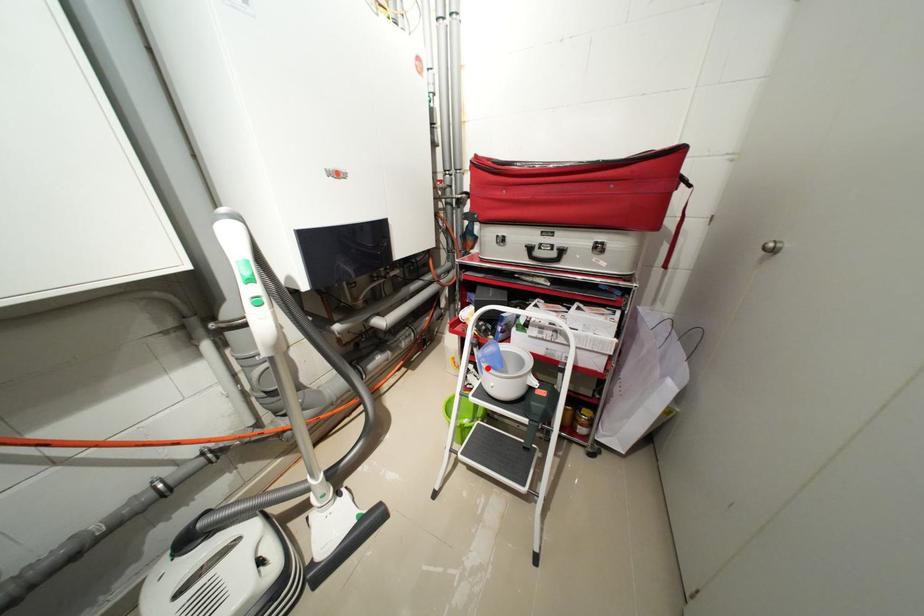
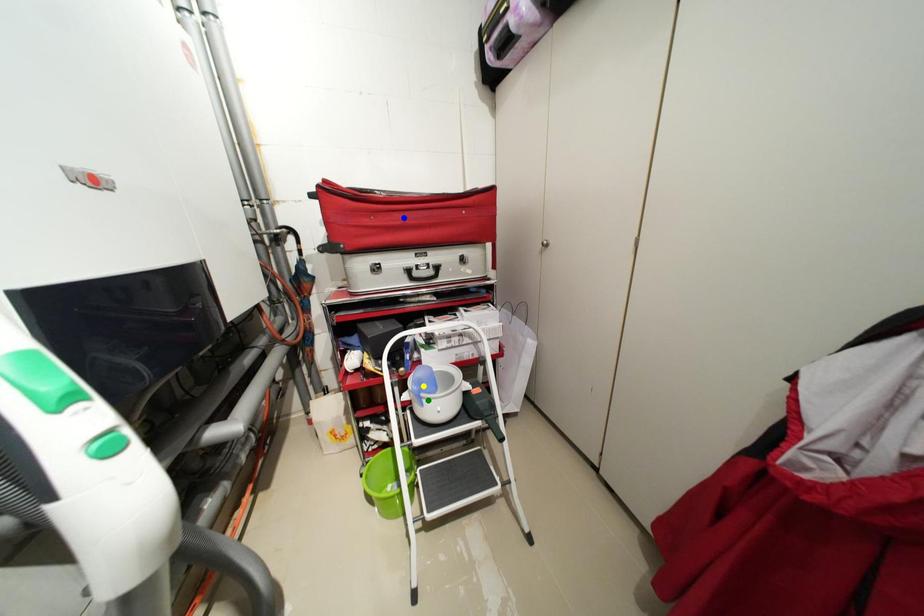
Question: I am providing you with two images of the same scene from different viewpoints. A red point is marked on the first image. You are given multiple points on the second image. Which mark in image 2 goes with the point in image 1?

Choices:
 (A) blue point
 (B) yellow point
 (C) green point

Answer: (C)